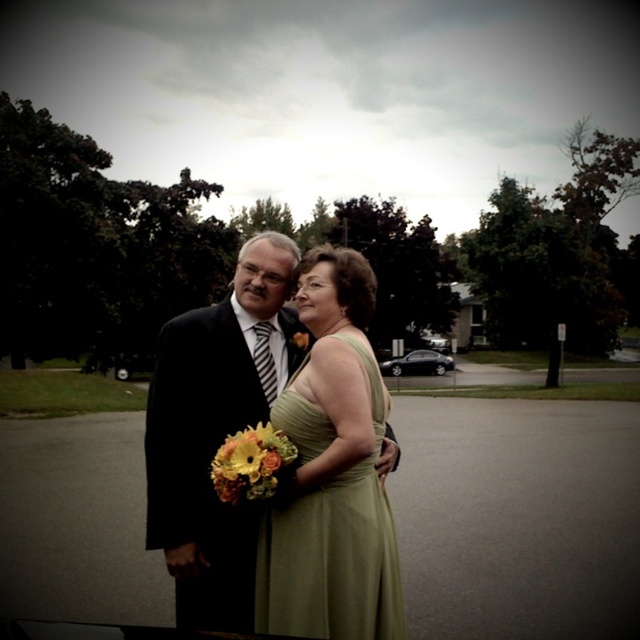
Is green satin dress at center thinner than matte black suit at center?

Yes.

Between green satin dress at center and matte black suit at center, which one is positioned lower?

matte black suit at center is lower down.

Between point (336, 612) and point (220, 376), which one is positioned in front?

Point (336, 612) is more forward.

At what (x,y) coordinates should I click in order to perform the action: click on green satin dress at center. Please return your answer as a coordinate pair (x, y). The height and width of the screenshot is (640, 640). Looking at the image, I should click on (332, 472).

Which of these two, matte black suit at center or vibrant floral bouquet at center, stands taller?

Standing taller between the two is matte black suit at center.

Does point (218, 536) come farther from viewer compared to point (221, 451)?

Yes, point (218, 536) is behind point (221, 451).

Find the location of a particular element. This screenshot has width=640, height=640. matte black suit at center is located at coordinates (216, 429).

Is point (289, 326) behind point (304, 336)?

Yes.

Who is more distant from viewer, (166,522) or (300,333)?

Point (300,333)

I want to click on matte black suit at center, so click(216, 429).